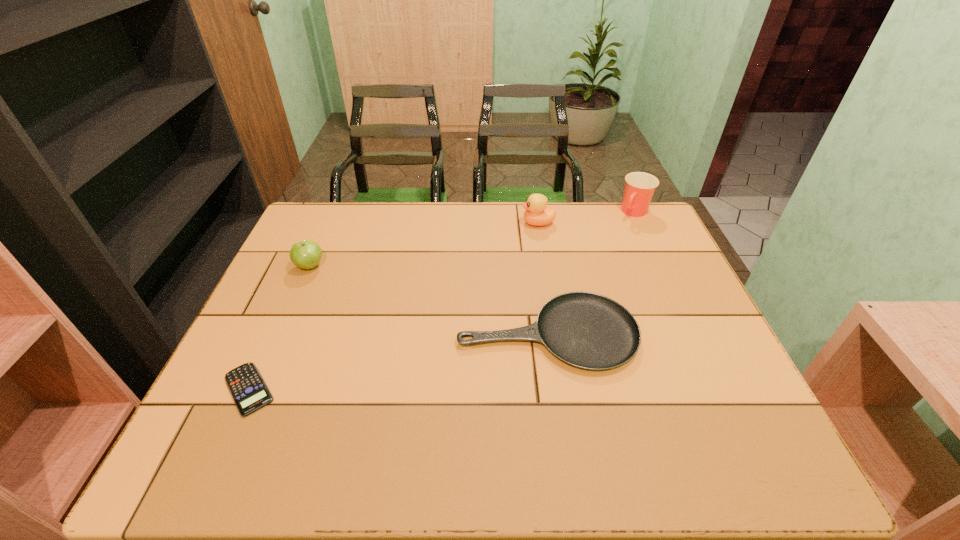
The height and width of the screenshot is (540, 960). Identify the location of free region located 0.170m on the right of the second shortest object. (707, 334).

The height and width of the screenshot is (540, 960). What are the coordinates of `vacant space located 0.290m on the back of the calculator` in the screenshot? It's located at (299, 279).

This screenshot has height=540, width=960. In order to click on cup that is at the far edge in this screenshot , I will do `click(639, 188)`.

The width and height of the screenshot is (960, 540). What are the coordinates of `duckling that is at the far edge` in the screenshot? It's located at (536, 213).

This screenshot has height=540, width=960. I want to click on apple at the left edge, so click(306, 254).

Locate an element on the screen. Image resolution: width=960 pixels, height=540 pixels. calculator positioned at the left edge is located at coordinates (248, 389).

Identify the location of object that is positioned at the right edge. The height and width of the screenshot is (540, 960). (639, 188).

I want to click on object present at the far right corner, so click(x=639, y=188).

In order to click on vacant position at the far edge of the desktop in this screenshot , I will do `click(583, 222)`.

Where is `vacant space at the near edge of the desktop`? This screenshot has width=960, height=540. vacant space at the near edge of the desktop is located at coordinates (413, 454).